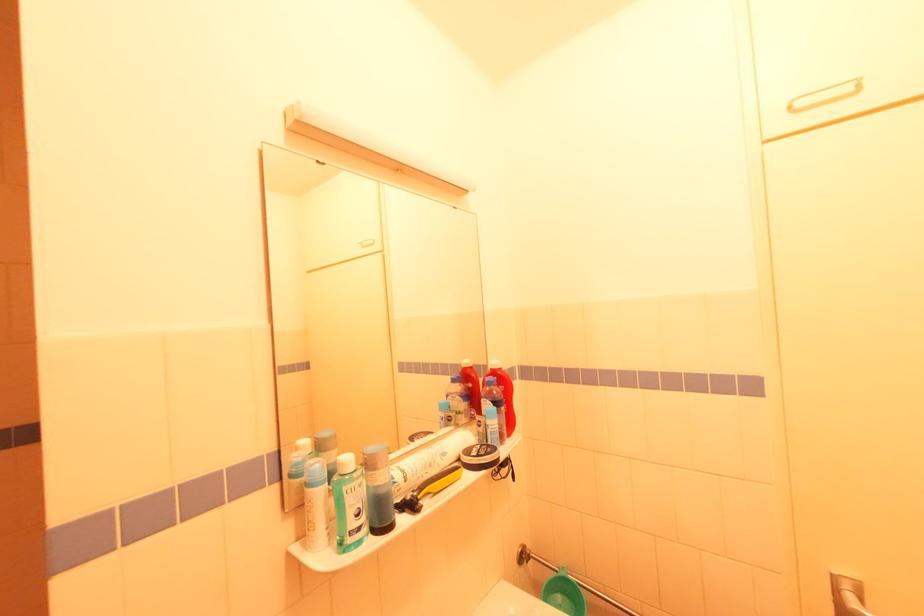
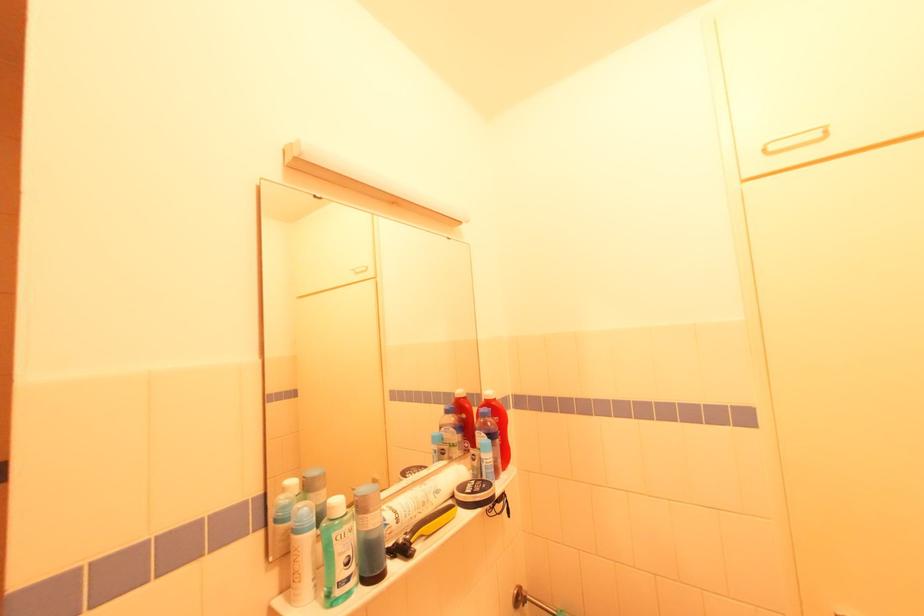
Find the pixel in the second image that matches pixel 497 379 in the first image.

(492, 410)